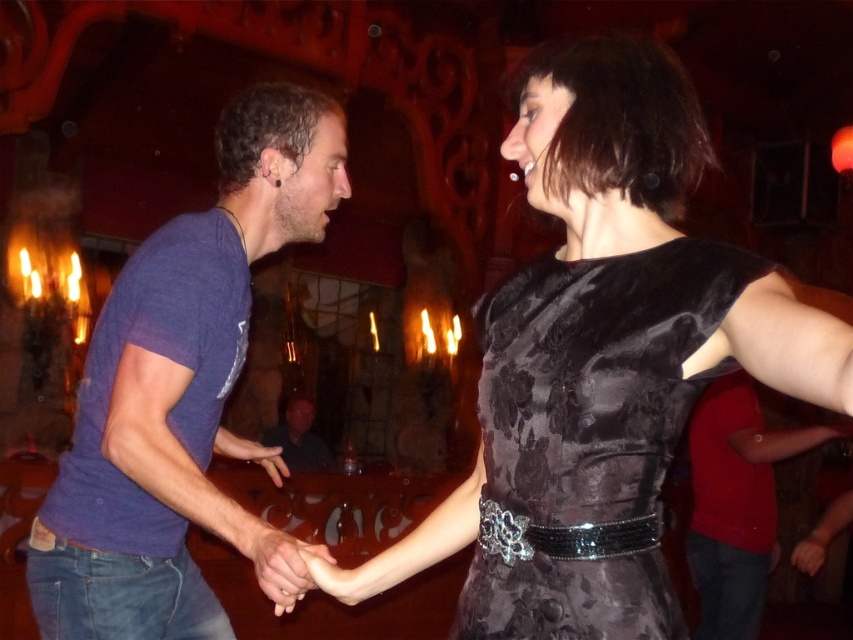
Question: Which is farther from the matte blue t-shirt at left?

Choices:
 (A) smooth skin hand at center
 (B) satin black dress at center
 (C) velvet black dress at center
 (D) matte blue shirt at left

Answer: (D)

Question: Can you confirm if matte blue shirt at left is thinner than smooth skin hand at center?

Choices:
 (A) yes
 (B) no

Answer: (B)

Question: Which of the following is the farthest from the observer?

Choices:
 (A) velvet black dress at center
 (B) matte blue t-shirt at left
 (C) matte blue shirt at center
 (D) matte blue shirt at left

Answer: (C)

Question: Which point is farther to the camera?

Choices:
 (A) matte blue t-shirt at left
 (B) matte blue shirt at center
 (C) matte blue shirt at left

Answer: (B)

Question: Is matte blue shirt at left further to the viewer compared to smooth skin hand at center?

Choices:
 (A) no
 (B) yes

Answer: (B)

Question: Is matte blue t-shirt at left to the left of velvet black dress at center from the viewer's perspective?

Choices:
 (A) no
 (B) yes

Answer: (B)